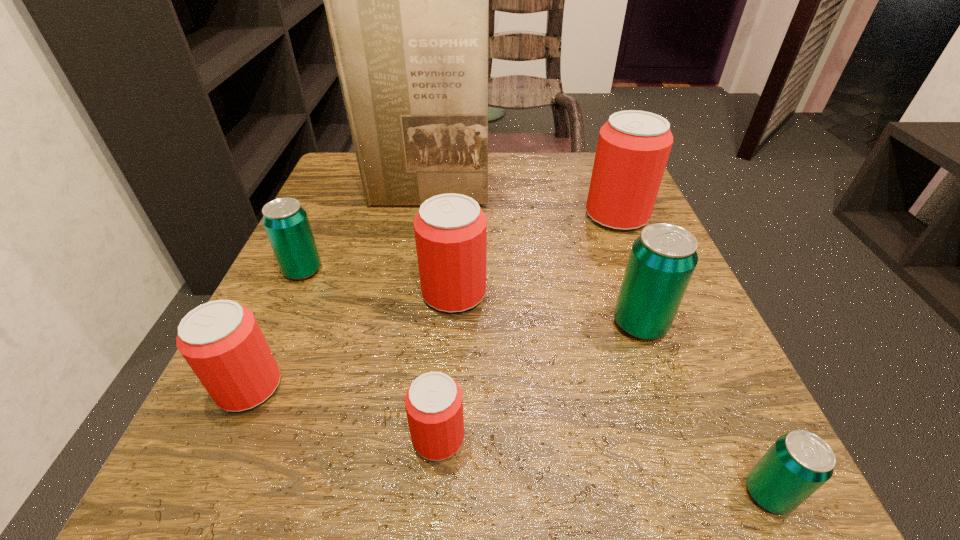
The height and width of the screenshot is (540, 960). Identify the location of phonebook that is at the far edge. (407, 0).

The image size is (960, 540). What are the coordinates of `beer can situated at the far edge` in the screenshot? It's located at (633, 147).

The image size is (960, 540). I want to click on phonebook that is at the left edge, so click(x=407, y=0).

Identify the location of object positioned at the far left corner. The height and width of the screenshot is (540, 960). (407, 0).

Image resolution: width=960 pixels, height=540 pixels. Find the location of `object at the far right corner`. object at the far right corner is located at coordinates (633, 147).

At what (x,y) coordinates should I click in order to perform the action: click on object that is at the near right corner. Please return your answer as a coordinate pair (x, y). Looking at the image, I should click on (798, 463).

I want to click on free region at the near edge, so click(525, 486).

Identify the location of free point at the left edge. (276, 278).

What are the coordinates of `vacant space at the right edge of the desktop` in the screenshot? It's located at (712, 327).

This screenshot has height=540, width=960. I want to click on vacant position at the far left corner of the desktop, so (322, 192).